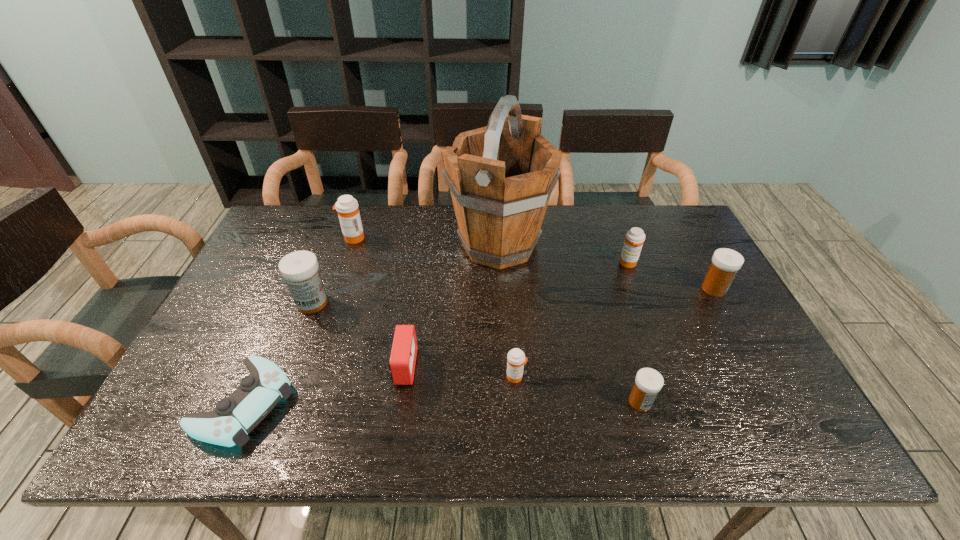
Where is `vacant area that lies between the biggest white medicine and the fourth object from left to right`? vacant area that lies between the biggest white medicine and the fourth object from left to right is located at coordinates (358, 335).

At what (x,y) coordinates should I click in order to perform the action: click on vacant space that is in between the fifth nearest medicine and the nearest orange medicine. Please return your answer as a coordinate pair (x, y). The width and height of the screenshot is (960, 540). Looking at the image, I should click on (572, 320).

Identify the location of blank region between the second smallest orange medicine and the shortest object. (436, 333).

The width and height of the screenshot is (960, 540). I want to click on free space between the fifth nearest medicine and the red alarm clock, so click(516, 315).

This screenshot has width=960, height=540. Identify the location of vacant area that lies between the biggest white medicine and the alarm clock. (358, 335).

Identify the location of blank region between the alarm clock and the smallest orange medicine. This screenshot has height=540, width=960. (460, 372).

The height and width of the screenshot is (540, 960). I want to click on unoccupied position between the biggest white medicine and the leftmost orange medicine, so pyautogui.click(x=333, y=271).

Locate which object is the third closest to the rightmost object. Please provide its 2D coordinates. Your answer should be formatted as a tuple, i.e. [(x, y)], where the tuple contains the x and y coordinates of a point satisfying the conditions above.

[(501, 176)]

Where is `object that can be found as the sixth closest to the farthest orange medicine`? The height and width of the screenshot is (540, 960). object that can be found as the sixth closest to the farthest orange medicine is located at coordinates (635, 237).

I want to click on the fifth closest medicine to the fourth medicine from left to right, so click(347, 207).